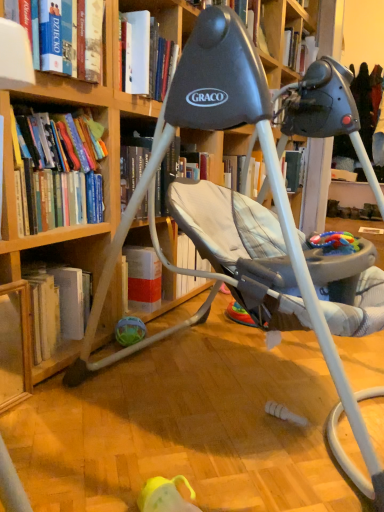
Measure the distance between point (x=125, y=332) and camera.

The depth of point (x=125, y=332) is 1.46 meters.

Where is `wooden bookshelf at lower left, which ranks as the 2th shelf in front-to-back order`? This screenshot has width=384, height=512. wooden bookshelf at lower left, which ranks as the 2th shelf in front-to-back order is located at coordinates (66, 249).

Image resolution: width=384 pixels, height=512 pixels. I want to click on wooden bookshelf at lower left, which appears as the 2th shelf when viewed from the back, so click(15, 345).

In order to face wooden bookshelf at lower left, the first shelf from the front, should I rotate leftwards or rightwards?

Rotate left and turn 28.902 degrees.

Image resolution: width=384 pixels, height=512 pixels. What do you see at coordinates (334, 242) in the screenshot?
I see `multicolored plastic toy at center, which is counted as the 2th toy, starting from the back` at bounding box center [334, 242].

The image size is (384, 512). Describe the element at coordinates (67, 233) in the screenshot. I see `wooden bookcase at center` at that location.

Identify the location of translucent plastic ball at lower center, the first toy positioned from the back. (130, 331).

Which of these two, multicolored plastic toy at center, the 2th toy from the bottom, or hardcover books at left, arranged as the second book when viewed from the top, stands shorter?

Standing shorter between the two is multicolored plastic toy at center, the 2th toy from the bottom.

Could you tell me if multicolored plastic toy at center, which is the first toy from top to bottom, is facing hardcover books at left, arranged as the second book when viewed from the top?

No, multicolored plastic toy at center, which is the first toy from top to bottom, does not turn towards hardcover books at left, arranged as the second book when viewed from the top.

Can you confirm if multicolored plastic toy at center, the first toy viewed from the right, is wider than hardcover books at left, the 1th book in the bottom-to-top sequence?

No.

How far apart are multicolored plastic toy at center, the 1th toy positioned from the front, and hardcover books at left, the 1th book in the bottom-to-top sequence?

multicolored plastic toy at center, the 1th toy positioned from the front, and hardcover books at left, the 1th book in the bottom-to-top sequence, are 29.37 inches apart.

Is wooden bookshelf at lower left, which appears as the 2th shelf when viewed from the back, oriented away from hardcover book at upper left, arranged as the 2th book when ordered from the bottom?

wooden bookshelf at lower left, which appears as the 2th shelf when viewed from the back, does not have its back to hardcover book at upper left, arranged as the 2th book when ordered from the bottom.

Considering the positions of objects wooden bookshelf at lower left, which appears as the 2th shelf when viewed from the back, and hardcover book at upper left, which is the 1th book in top-to-bottom order, in the image provided, who is in front, wooden bookshelf at lower left, which appears as the 2th shelf when viewed from the back, or hardcover book at upper left, which is the 1th book in top-to-bottom order,?

wooden bookshelf at lower left, which appears as the 2th shelf when viewed from the back, is in front.

Is wooden bookshelf at lower left, the first shelf from the front, to the left or to the right of hardcover book at upper left, arranged as the 2th book when ordered from the bottom, in the image?

From the image, it's evident that wooden bookshelf at lower left, the first shelf from the front, is to the left of hardcover book at upper left, arranged as the 2th book when ordered from the bottom.

Looking at the image, does wooden bookshelf at lower left, which appears as the 2th shelf when viewed from the back, seem bigger or smaller compared to hardcover book at upper left, which is the 1th book in top-to-bottom order?

Considering their sizes, wooden bookshelf at lower left, which appears as the 2th shelf when viewed from the back, takes up less space than hardcover book at upper left, which is the 1th book in top-to-bottom order.

Considering the relative sizes of hardcover books at left, arranged as the second book when viewed from the top, and wooden bookshelf at lower left, the first shelf positioned from the back, in the image provided, is hardcover books at left, arranged as the second book when viewed from the top, bigger than wooden bookshelf at lower left, the first shelf positioned from the back,?

Yes, hardcover books at left, arranged as the second book when viewed from the top, is bigger than wooden bookshelf at lower left, the first shelf positioned from the back.

At what (x,y) coordinates should I click in order to perform the action: click on the 1st book in front when counting from the wooden bookshelf at lower left, which ranks as the 2th shelf in front-to-back order. Please return your answer as a coordinate pair (x, y). The width and height of the screenshot is (384, 512). Looking at the image, I should click on (58, 170).

Would you say wooden bookshelf at lower left, the first shelf positioned from the back, is part of hardcover books at left, the 1th book in the bottom-to-top sequence,'s contents?

No, hardcover books at left, the 1th book in the bottom-to-top sequence, does not contain wooden bookshelf at lower left, the first shelf positioned from the back.

From a real-world perspective, which is physically below, hardcover book at upper left, which is the 1th book in top-to-bottom order, or hardcover books at left, arranged as the second book when viewed from the top?

hardcover books at left, arranged as the second book when viewed from the top, is physically lower.

Is hardcover book at upper left, which is the 1th book in top-to-bottom order, completely or partially outside of hardcover books at left, the 1th book in the bottom-to-top sequence?

Yes, hardcover book at upper left, which is the 1th book in top-to-bottom order, is located beyond the bounds of hardcover books at left, the 1th book in the bottom-to-top sequence.

Can you confirm if hardcover book at upper left, which is the 1th book in top-to-bottom order, is positioned to the left of hardcover books at left, the 1th book in the bottom-to-top sequence?

Incorrect, hardcover book at upper left, which is the 1th book in top-to-bottom order, is not on the left side of hardcover books at left, the 1th book in the bottom-to-top sequence.

From a real-world perspective, is multicolored plastic toy at center, which is counted as the 2th toy, starting from the back, under wooden bookshelf at lower left, the first shelf from the front?

No, from a real-world perspective, multicolored plastic toy at center, which is counted as the 2th toy, starting from the back, is not below wooden bookshelf at lower left, the first shelf from the front.

Looking at the image, does multicolored plastic toy at center, which is counted as the 2th toy, starting from the left, seem bigger or smaller compared to wooden bookshelf at lower left, the first shelf from the front?

In the image, multicolored plastic toy at center, which is counted as the 2th toy, starting from the left, appears to be smaller than wooden bookshelf at lower left, the first shelf from the front.

Between point (354, 251) and point (2, 353), which one is positioned in front?

The point (354, 251) is in front.

From the image's perspective, between multicolored plastic toy at center, the 1th toy positioned from the front, and translucent plastic ball at lower center, which is counted as the first toy, starting from the bottom, who is located below?

From the image's view, translucent plastic ball at lower center, which is counted as the first toy, starting from the bottom, is below.

From the picture: Would you say multicolored plastic toy at center, which is counted as the 2th toy, starting from the left, is a long distance from translucent plastic ball at lower center, which is counted as the first toy, starting from the bottom?

Actually, multicolored plastic toy at center, which is counted as the 2th toy, starting from the left, and translucent plastic ball at lower center, which is counted as the first toy, starting from the bottom, are a little close together.

Consider the image. Would you say translucent plastic ball at lower center, marked as the 2th toy in a front-to-back arrangement, is part of multicolored plastic toy at center, which is counted as the 2th toy, starting from the back,'s contents?

No, translucent plastic ball at lower center, marked as the 2th toy in a front-to-back arrangement, is located outside of multicolored plastic toy at center, which is counted as the 2th toy, starting from the back.

Which object is positioned more to the left, translucent plastic ball at lower center, marked as the 2th toy in a front-to-back arrangement, or wooden bookshelf at lower left, the first shelf positioned from the back?

From the viewer's perspective, wooden bookshelf at lower left, the first shelf positioned from the back, appears more on the left side.

Relative to wooden bookshelf at lower left, which ranks as the 2th shelf in front-to-back order, is translucent plastic ball at lower center, which is counted as the first toy, starting from the bottom, in front or behind?

In the image, translucent plastic ball at lower center, which is counted as the first toy, starting from the bottom, appears behind wooden bookshelf at lower left, which ranks as the 2th shelf in front-to-back order.

Is translucent plastic ball at lower center, which ranks as the second toy in right-to-left order, aimed at wooden bookshelf at lower left, the first shelf positioned from the back?

No, translucent plastic ball at lower center, which ranks as the second toy in right-to-left order, is not facing towards wooden bookshelf at lower left, the first shelf positioned from the back.

From a real-world perspective, starting from the multicolored plastic toy at center, which is counted as the 2th toy, starting from the back, which book is the 1st one vertically above it? Please provide its 2D coordinates.

[(58, 170)]

I want to click on shelf that is the 1st object directly below the hardcover book at upper left, arranged as the 2th book when ordered from the bottom (from a real-world perspective), so click(15, 345).

When comparing their distances from translucent plastic ball at lower center, the 1th toy positioned from the left, does hardcover book at upper left, arranged as the 2th book when ordered from the bottom, or wooden bookshelf at lower left, the first shelf from the front, seem further?

hardcover book at upper left, arranged as the 2th book when ordered from the bottom, is further to translucent plastic ball at lower center, the 1th toy positioned from the left.

Considering their positions, is wooden bookshelf at lower left, the first shelf from the front, positioned closer to hardcover books at left, arranged as the second book when viewed from the top, than translucent plastic ball at lower center, marked as the 2th toy in a front-to-back arrangement?

The object closer to hardcover books at left, arranged as the second book when viewed from the top, is wooden bookshelf at lower left, the first shelf from the front.

Looking at the image, which one is located further to translucent plastic ball at lower center, which ranks as the second toy in right-to-left order, multicolored plastic toy at center, which is counted as the 2th toy, starting from the left, or hardcover books at left, arranged as the second book when viewed from the top?

multicolored plastic toy at center, which is counted as the 2th toy, starting from the left, is positioned further to the anchor translucent plastic ball at lower center, which ranks as the second toy in right-to-left order.

From the picture: From the image, which object appears to be nearer to multicolored plastic toy at center, which is counted as the 2th toy, starting from the back, hardcover book at upper left, which is the 1th book in top-to-bottom order, or wooden bookshelf at lower left, the first shelf from the front?

Among the two, hardcover book at upper left, which is the 1th book in top-to-bottom order, is located nearer to multicolored plastic toy at center, which is counted as the 2th toy, starting from the back.

From the image, which object appears to be farther from hardcover books at left, arranged as the second book when viewed from the top, wooden bookshelf at lower left, the first shelf from the front, or wooden bookshelf at lower left, which ranks as the 2th shelf in front-to-back order?

wooden bookshelf at lower left, the first shelf from the front, lies further to hardcover books at left, arranged as the second book when viewed from the top, than the other object.

Estimate the real-world distances between objects in this image. Which object is further from hardcover books at left, the 1th book in the bottom-to-top sequence, multicolored plastic toy at center, the 2th toy from the bottom, or wooden bookshelf at lower left, the first shelf positioned from the back?

multicolored plastic toy at center, the 2th toy from the bottom, is positioned further to the anchor hardcover books at left, the 1th book in the bottom-to-top sequence.

Based on their spatial positions, is wooden bookshelf at lower left, which ranks as the 2th shelf in front-to-back order, or hardcover book at upper left, which is the 1th book in top-to-bottom order, closer to wooden bookshelf at lower left, which appears as the 2th shelf when viewed from the back?

wooden bookshelf at lower left, which ranks as the 2th shelf in front-to-back order, lies closer to wooden bookshelf at lower left, which appears as the 2th shelf when viewed from the back, than the other object.

When comparing their distances from wooden bookshelf at lower left, the first shelf from the front, does hardcover book at upper left, which is the 1th book in top-to-bottom order, or multicolored plastic toy at center, which is counted as the 2th toy, starting from the left, seem further?

multicolored plastic toy at center, which is counted as the 2th toy, starting from the left, is further to wooden bookshelf at lower left, the first shelf from the front.

What are the coordinates of `shelf between hardcover book at upper left, arranged as the 2th book when ordered from the bottom, and wooden bookshelf at lower left, which appears as the 2th shelf when viewed from the back, vertically` in the screenshot? It's located at (66, 249).

Where is `bookcase between wooden bookshelf at lower left, which appears as the 2th shelf when viewed from the back, and multicolored plastic toy at center, which is counted as the 2th toy, starting from the left`? bookcase between wooden bookshelf at lower left, which appears as the 2th shelf when viewed from the back, and multicolored plastic toy at center, which is counted as the 2th toy, starting from the left is located at coordinates (67, 233).

Find the location of a particular element. The image size is (384, 512). book located between hardcover books at left, the 1th book in the bottom-to-top sequence, and multicolored plastic toy at center, the first toy viewed from the right, in the left-right direction is located at coordinates (90, 39).

I want to click on toy between wooden bookshelf at lower left, which ranks as the 2th shelf in front-to-back order, and multicolored plastic toy at center, which is the first toy from top to bottom, from left to right, so click(x=130, y=331).